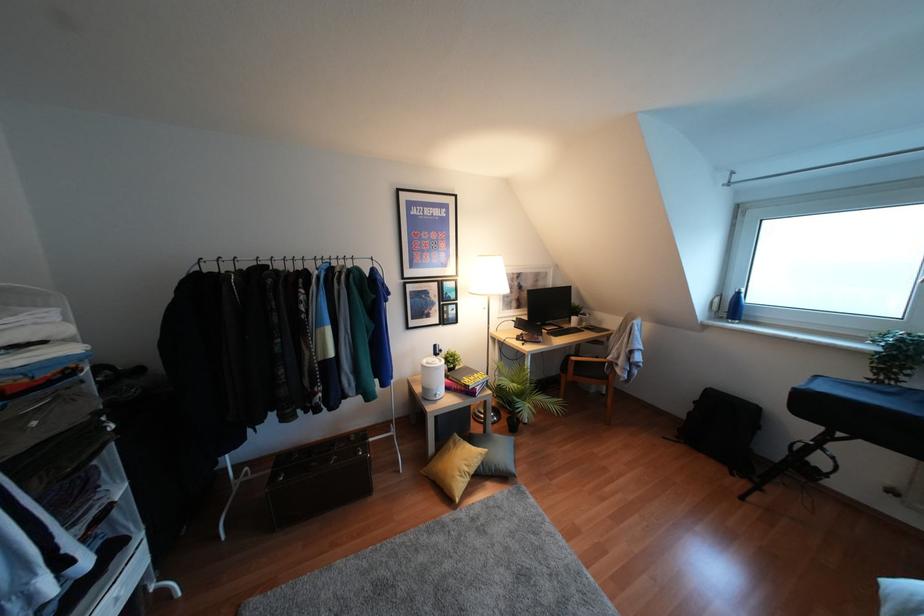
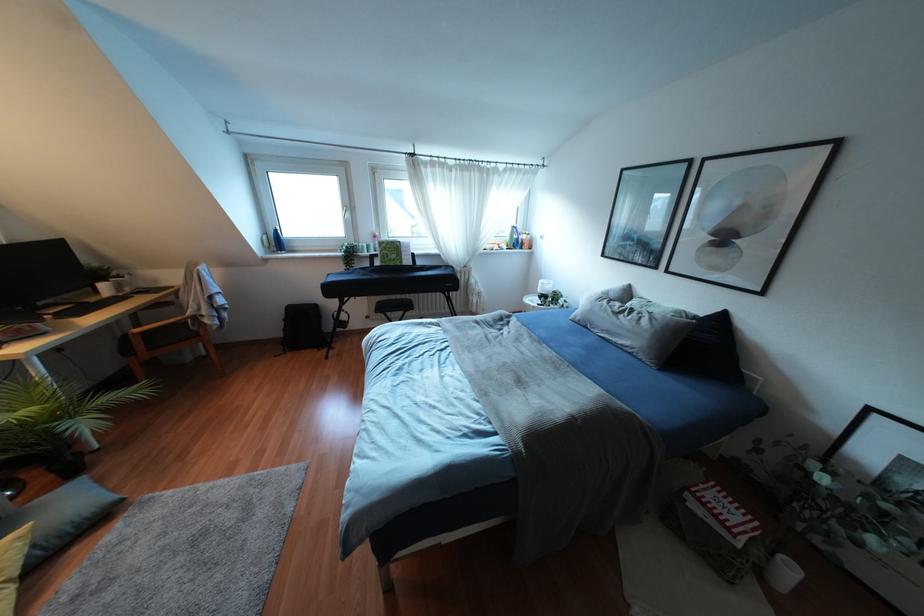
In the second image, find the point that corresponds to the point at 604,378 in the first image.

(196, 334)